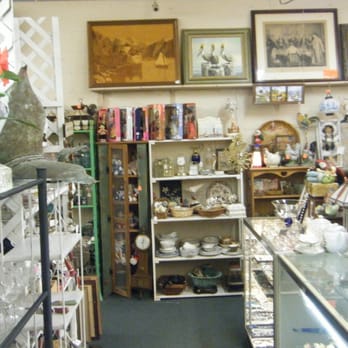
This screenshot has height=348, width=348. In order to click on beige wall in this screenshot , I will do `click(74, 86)`.